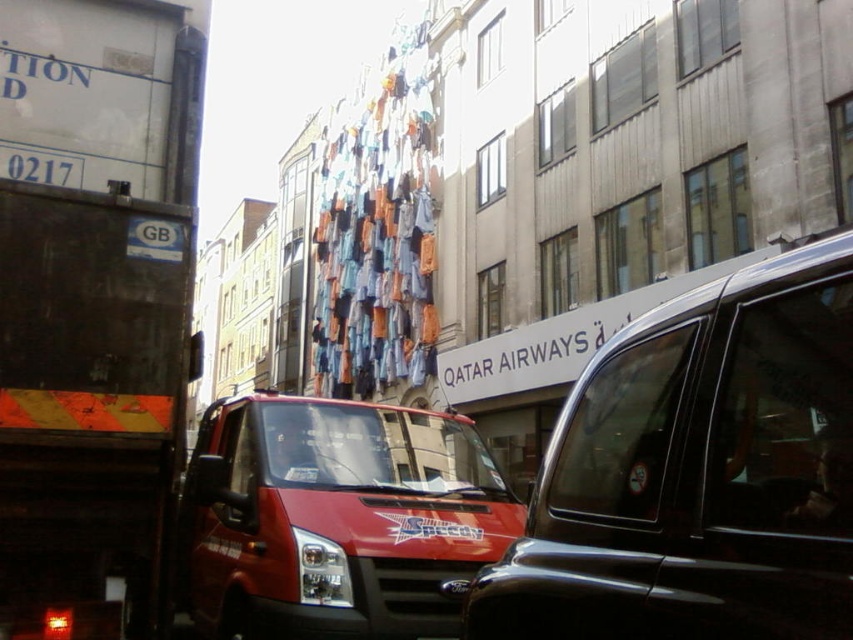
Between point (753, 570) and point (494, 516), which one is positioned behind?

Point (494, 516)

Is the position of black glossy taxi at center-right more distant than that of matte red van at center?

No, black glossy taxi at center-right is in front of matte red van at center.

In the scene shown: Measure the distance between point (788, 253) and camera.

They are 5.30 meters apart.

Identify the location of black glossy taxi at center-right. The width and height of the screenshot is (853, 640). (697, 472).

Can you confirm if matte black truck at left is shorter than black glossy taxi at center-right?

In fact, matte black truck at left may be taller than black glossy taxi at center-right.

Who is positioned more to the right, matte black truck at left or black glossy taxi at center-right?

Positioned to the right is black glossy taxi at center-right.

Measure the distance between point (135,349) and camera.

Point (135,349) and camera are 2.19 meters apart from each other.

Identify the location of matte black truck at left. (94, 307).

Can you confirm if matte black truck at left is positioned to the left of matte red van at center?

Indeed, matte black truck at left is positioned on the left side of matte red van at center.

Is point (114, 520) closer to camera compared to point (492, 536)?

Yes, it is.

The width and height of the screenshot is (853, 640). Find the location of `matte black truck at left`. matte black truck at left is located at coordinates (94, 307).